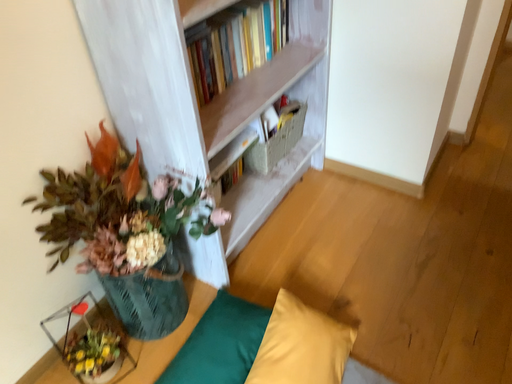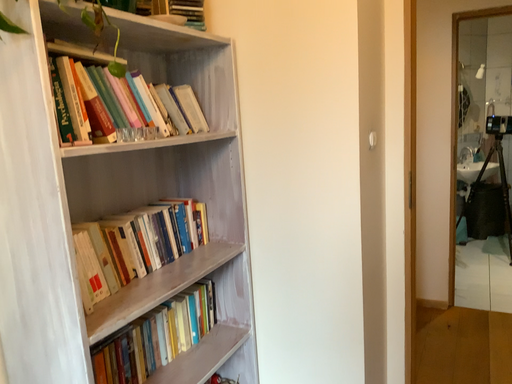
Question: Which way did the camera rotate in the video?

Choices:
 (A) rotated downward
 (B) rotated upward

Answer: (B)